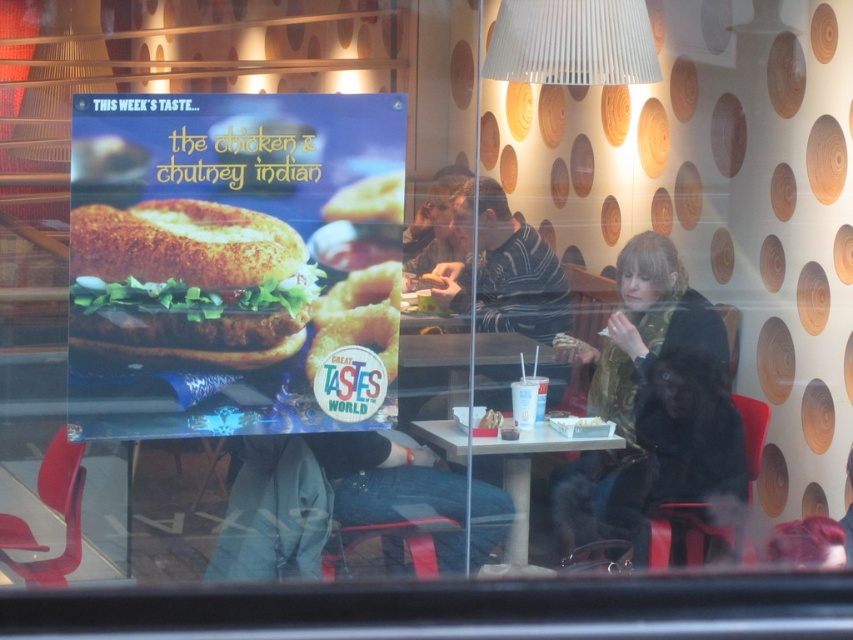
Question: Which point appears farthest from the camera in this image?

Choices:
 (A) (733, 492)
 (B) (560, 280)
 (C) (622, 440)

Answer: (B)

Question: Which object appears closest to the camera in this image?

Choices:
 (A) breaded golden-brown hamburger at center
 (B) green wool scarf at center
 (C) white plastic table at center
 (D) striped sweater at center

Answer: (A)

Question: From the image, what is the correct spatial relationship of green wool scarf at center in relation to breaded golden-brown hamburger at center?

Choices:
 (A) left
 (B) right

Answer: (B)

Question: Which of the following is the farthest from the observer?

Choices:
 (A) striped sweater at center
 (B) breaded golden-brown hamburger at center
 (C) white plastic table at center

Answer: (A)

Question: Does green wool scarf at center have a greater width compared to breaded golden-brown hamburger at center?

Choices:
 (A) yes
 (B) no

Answer: (B)

Question: Can you confirm if breaded golden-brown hamburger at center is positioned above striped sweater at center?

Choices:
 (A) no
 (B) yes

Answer: (A)